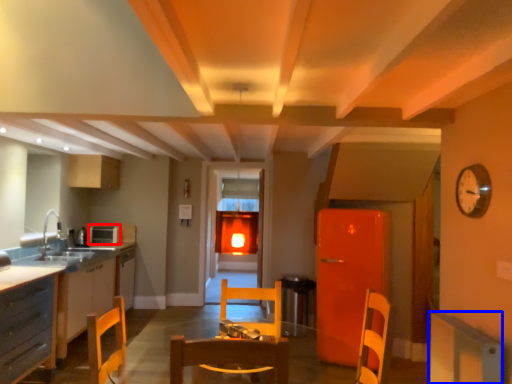
Question: Among these objects, which one is farthest to the camera, appliance (highlighted by a red box) or cabinetry (highlighted by a blue box)?

Choices:
 (A) appliance
 (B) cabinetry

Answer: (A)